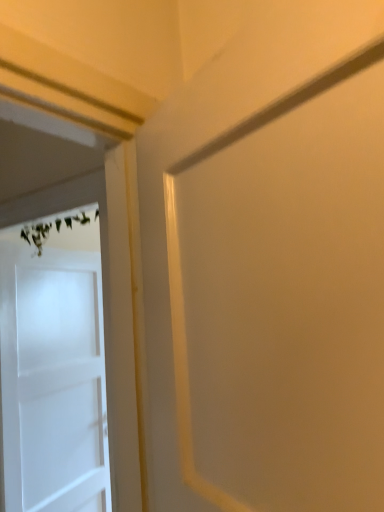
What do you see at coordinates (63, 210) in the screenshot?
I see `white matte door at left` at bounding box center [63, 210].

Measure the distance between point (106,273) and camera.

Point (106,273) and camera are 97.60 centimeters apart.

You are a GUI agent. You are given a task and a screenshot of the screen. Output one action in this format:
    pyautogui.click(x=<x>, y=<y>)
    Task: Click on the white matte door at left
    Image resolution: width=384 pixels, height=512 pixels.
    Given the screenshot: What is the action you would take?
    pyautogui.click(x=63, y=210)

I want to click on white matte door at left, so click(x=63, y=210).